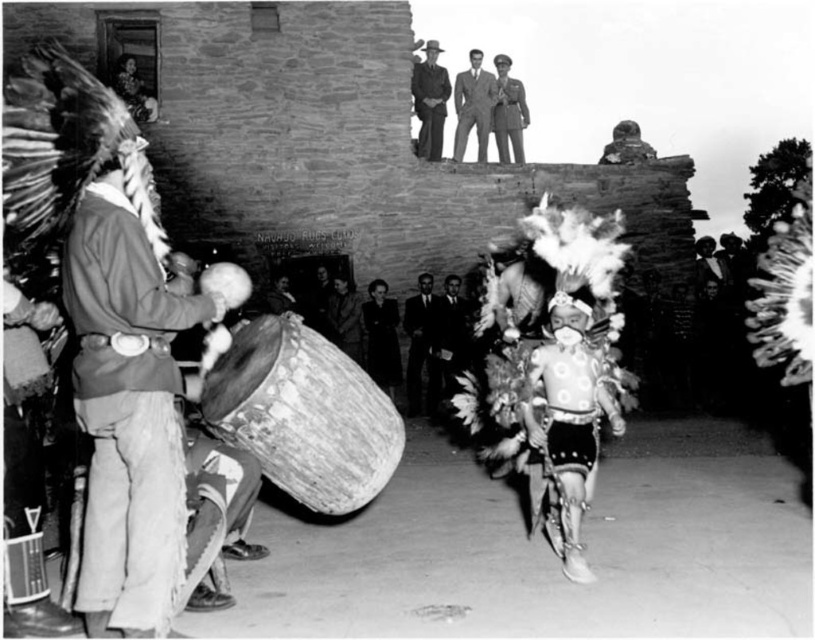
Is wooden textured drum at center taller than smooth leather jacket at upper center?

No.

Is wooden textured drum at center positioned in front of smooth leather jacket at upper center?

Yes, wooden textured drum at center is in front of smooth leather jacket at upper center.

Between point (349, 461) and point (510, 145), which one is positioned in front?

Point (349, 461)

This screenshot has height=640, width=815. I want to click on wooden textured drum at center, so [x=302, y=413].

Between wooden textured drum at center and smooth leather hat at upper center, which one is positioned higher?

Positioned higher is smooth leather hat at upper center.

Describe the element at coordinates (302, 413) in the screenshot. I see `wooden textured drum at center` at that location.

Identify the location of wooden textured drum at center. (302, 413).

Does point (106, 525) come in front of point (385, 282)?

Yes, point (106, 525) is in front of point (385, 282).

Which is more to the right, leather jacket at left or dark wool coat at center?

Positioned to the right is dark wool coat at center.

I want to click on leather jacket at left, so click(128, 412).